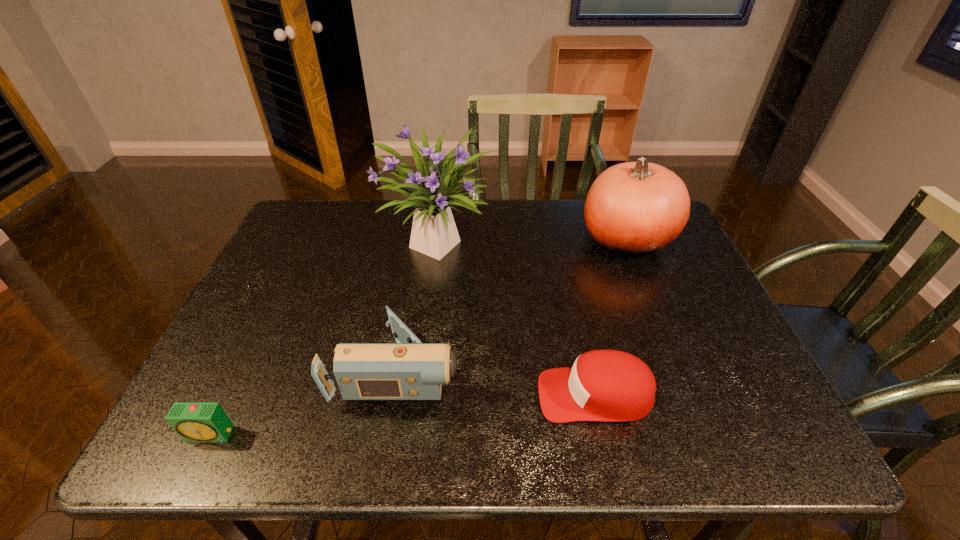
The image size is (960, 540). I want to click on vacant point located 0.110m on the front-facing side of the baseball cap, so click(x=485, y=395).

The image size is (960, 540). Find the location of `free space located 0.390m on the front-facing side of the baseball cap`. free space located 0.390m on the front-facing side of the baseball cap is located at coordinates (348, 395).

Identify the location of flower arrangement situated at the far edge. The height and width of the screenshot is (540, 960). pyautogui.click(x=434, y=233).

Locate an element on the screen. The image size is (960, 540). pumpkin that is at the far edge is located at coordinates (633, 208).

This screenshot has height=540, width=960. Find the location of `camcorder present at the near edge`. camcorder present at the near edge is located at coordinates (409, 370).

This screenshot has width=960, height=540. What are the coordinates of `baseball cap at the near edge` in the screenshot? It's located at (602, 385).

I want to click on alarm clock located at the near edge, so click(x=193, y=421).

Locate an element on the screen. The height and width of the screenshot is (540, 960). object situated at the left edge is located at coordinates (193, 421).

You are a GUI agent. You are given a task and a screenshot of the screen. Output one action in this format:
    pyautogui.click(x=<x>, y=<y>)
    Task: Click on the object at the right edge
    The width and height of the screenshot is (960, 540).
    Given the screenshot: What is the action you would take?
    pyautogui.click(x=633, y=208)

Locate an element on the screen. object that is at the near left corner is located at coordinates (193, 421).